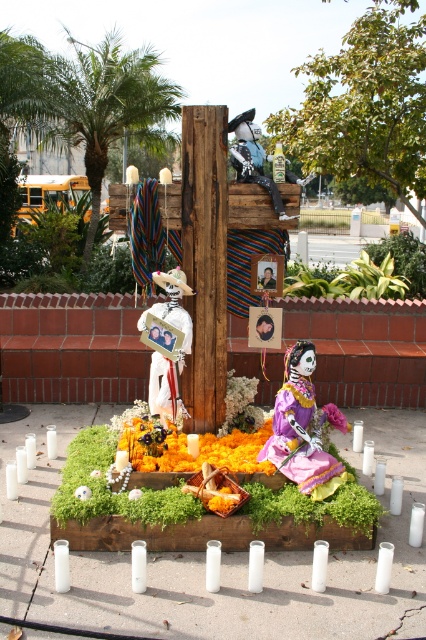
You are setting up an altar for DIA DE LOS MUERTOS. You have a white paper photo frame at center and a white paper skull at center. Which object should you place on the altar first if you want the wider object to be placed first?

The white paper photo frame at center might be wider than the white paper skull at center, so you should place the white paper photo frame at center first.

You are an altar decorator who needs to place a small candle between the marigold petals at center and the pink fabric flower at center. Based on their positions, which object should the candle be closer to?

The candle should be placed closer to the pink fabric flower at center because the marigold petals at center is to the left of pink fabric flower at center.